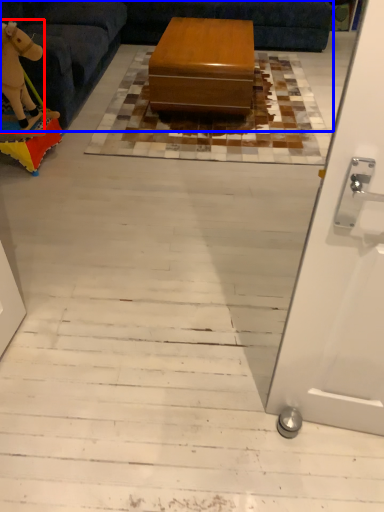
Question: Among these objects, which one is nearest to the camera, animal (highlighted by a red box) or couch (highlighted by a blue box)?

Choices:
 (A) animal
 (B) couch

Answer: (B)